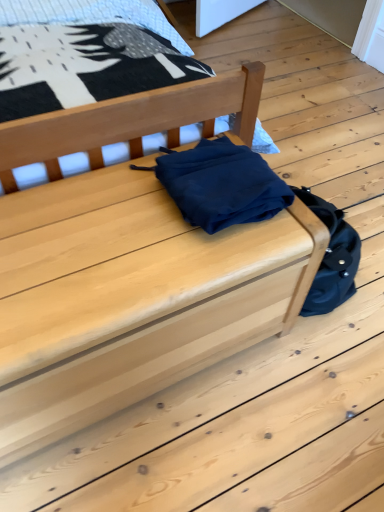
How much space does matte wood chest at center, arranged as the 1th furniture when ordered from the bottom, occupy vertically?

matte wood chest at center, arranged as the 1th furniture when ordered from the bottom, is 19.01 inches tall.

Describe the element at coordinates (131, 268) in the screenshot. I see `matte wood chest at center, the 2th furniture from the top` at that location.

Identify the location of matte wood chest at center, the 2th furniture from the top. The width and height of the screenshot is (384, 512). (131, 268).

Measure the distance between point (137,123) and camera.

Point (137,123) and camera are 1.13 meters apart from each other.

What do you see at coordinates (138, 115) in the screenshot? I see `matte wood chest at center, which is counted as the first furniture, starting from the top` at bounding box center [138, 115].

Identify the location of matte wood chest at center, which is counted as the first furniture, starting from the top. The height and width of the screenshot is (512, 384). (138, 115).

Where is `matte wood chest at center, arranged as the 1th furniture when ordered from the bottom`? Image resolution: width=384 pixels, height=512 pixels. matte wood chest at center, arranged as the 1th furniture when ordered from the bottom is located at coordinates (131, 268).

Is matte wood chest at center, arranged as the 1th furniture when ordered from the bottom, to the right of matte wood chest at center, which is counted as the first furniture, starting from the top, from the viewer's perspective?

Correct, you'll find matte wood chest at center, arranged as the 1th furniture when ordered from the bottom, to the right of matte wood chest at center, which is counted as the first furniture, starting from the top.

Considering the relative positions of matte wood chest at center, arranged as the 1th furniture when ordered from the bottom, and matte wood chest at center, which is counted as the first furniture, starting from the top, in the image provided, is matte wood chest at center, arranged as the 1th furniture when ordered from the bottom, behind matte wood chest at center, which is counted as the first furniture, starting from the top,?

No, it is in front of matte wood chest at center, which is counted as the first furniture, starting from the top.

Does point (9, 435) come closer to viewer compared to point (201, 84)?

Yes.

From the image's perspective, is matte wood chest at center, the 2th furniture from the top, above or below matte wood chest at center, which is counted as the first furniture, starting from the top?

Based on their image positions, matte wood chest at center, the 2th furniture from the top, is located beneath matte wood chest at center, which is counted as the first furniture, starting from the top.

From a real-world perspective, is matte wood chest at center, the 2th furniture from the top, positioned over matte wood chest at center, placed as the second furniture when sorted from bottom to top, based on gravity?

No.

Considering the relative sizes of matte wood chest at center, the 2th furniture from the top, and matte wood chest at center, which is counted as the first furniture, starting from the top, in the image provided, is matte wood chest at center, the 2th furniture from the top, thinner than matte wood chest at center, which is counted as the first furniture, starting from the top,?

Indeed, matte wood chest at center, the 2th furniture from the top, has a lesser width compared to matte wood chest at center, which is counted as the first furniture, starting from the top.

Does matte wood chest at center, the 2th furniture from the top, have a lesser height compared to matte wood chest at center, placed as the second furniture when sorted from bottom to top?

Indeed, matte wood chest at center, the 2th furniture from the top, has a lesser height compared to matte wood chest at center, placed as the second furniture when sorted from bottom to top.

Considering the relative sizes of matte wood chest at center, the 2th furniture from the top, and matte wood chest at center, which is counted as the first furniture, starting from the top, in the image provided, is matte wood chest at center, the 2th furniture from the top, smaller than matte wood chest at center, which is counted as the first furniture, starting from the top,?

Correct, matte wood chest at center, the 2th furniture from the top, occupies less space than matte wood chest at center, which is counted as the first furniture, starting from the top.

Can we say matte wood chest at center, arranged as the 1th furniture when ordered from the bottom, lies outside matte wood chest at center, which is counted as the first furniture, starting from the top?

Absolutely, matte wood chest at center, arranged as the 1th furniture when ordered from the bottom, is external to matte wood chest at center, which is counted as the first furniture, starting from the top.

Are matte wood chest at center, the 2th furniture from the top, and matte wood chest at center, which is counted as the first furniture, starting from the top, beside each other?

matte wood chest at center, the 2th furniture from the top, and matte wood chest at center, which is counted as the first furniture, starting from the top, are clearly separated.

Is matte wood chest at center, arranged as the 1th furniture when ordered from the bottom, turned away from matte wood chest at center, which is counted as the first furniture, starting from the top?

Correct, matte wood chest at center, arranged as the 1th furniture when ordered from the bottom, is looking away from matte wood chest at center, which is counted as the first furniture, starting from the top.

In the image, there is a matte wood chest at center, placed as the second furniture when sorted from bottom to top. Where is `furniture below it (from a real-world perspective)`? The height and width of the screenshot is (512, 384). furniture below it (from a real-world perspective) is located at coordinates (131, 268).

Does matte wood chest at center, which is counted as the first furniture, starting from the top, appear on the right side of matte wood chest at center, arranged as the 1th furniture when ordered from the bottom?

No, matte wood chest at center, which is counted as the first furniture, starting from the top, is not to the right of matte wood chest at center, arranged as the 1th furniture when ordered from the bottom.

Does matte wood chest at center, placed as the second furniture when sorted from bottom to top, lie behind matte wood chest at center, arranged as the 1th furniture when ordered from the bottom?

Yes, the depth of matte wood chest at center, placed as the second furniture when sorted from bottom to top, is greater than that of matte wood chest at center, arranged as the 1th furniture when ordered from the bottom.

Considering the points (229, 78) and (5, 346), which point is behind, point (229, 78) or point (5, 346)?

Positioned behind is point (229, 78).

In the scene shown: From the image's perspective, who appears lower, matte wood chest at center, which is counted as the first furniture, starting from the top, or matte wood chest at center, the 2th furniture from the top?

matte wood chest at center, the 2th furniture from the top, appears lower in the image.

From a real-world perspective, is matte wood chest at center, which is counted as the first furniture, starting from the top, physically located above or below matte wood chest at center, the 2th furniture from the top?

From a real-world perspective, matte wood chest at center, which is counted as the first furniture, starting from the top, is physically above matte wood chest at center, the 2th furniture from the top.

Which of these two, matte wood chest at center, placed as the second furniture when sorted from bottom to top, or matte wood chest at center, arranged as the 1th furniture when ordered from the bottom, is thinner?

matte wood chest at center, arranged as the 1th furniture when ordered from the bottom.

Considering the sizes of objects matte wood chest at center, placed as the second furniture when sorted from bottom to top, and matte wood chest at center, arranged as the 1th furniture when ordered from the bottom, in the image provided, who is shorter, matte wood chest at center, placed as the second furniture when sorted from bottom to top, or matte wood chest at center, arranged as the 1th furniture when ordered from the bottom,?

matte wood chest at center, arranged as the 1th furniture when ordered from the bottom.

Who is smaller, matte wood chest at center, placed as the second furniture when sorted from bottom to top, or matte wood chest at center, the 2th furniture from the top?

Smaller between the two is matte wood chest at center, the 2th furniture from the top.

Is matte wood chest at center, which is counted as the first furniture, starting from the top, inside or outside of matte wood chest at center, arranged as the 1th furniture when ordered from the bottom?

matte wood chest at center, which is counted as the first furniture, starting from the top, is not enclosed by matte wood chest at center, arranged as the 1th furniture when ordered from the bottom.

In the scene shown: Does matte wood chest at center, placed as the second furniture when sorted from bottom to top, touch matte wood chest at center, arranged as the 1th furniture when ordered from the bottom?

No, matte wood chest at center, placed as the second furniture when sorted from bottom to top, is not next to matte wood chest at center, arranged as the 1th furniture when ordered from the bottom.

Is matte wood chest at center, arranged as the 1th furniture when ordered from the bottom, at the back of matte wood chest at center, placed as the second furniture when sorted from bottom to top?

matte wood chest at center, placed as the second furniture when sorted from bottom to top, does not have its back to matte wood chest at center, arranged as the 1th furniture when ordered from the bottom.

What's the angular difference between matte wood chest at center, which is counted as the first furniture, starting from the top, and matte wood chest at center, arranged as the 1th furniture when ordered from the bottom,'s facing directions?

0.337 degrees separate the facing orientations of matte wood chest at center, which is counted as the first furniture, starting from the top, and matte wood chest at center, arranged as the 1th furniture when ordered from the bottom.

You are a GUI agent. You are given a task and a screenshot of the screen. Output one action in this format:
    pyautogui.click(x=<x>, y=<y>)
    Task: Click on the furniture below the matte wood chest at center, placed as the second furniture when sorted from bottom to top (from a real-world perspective)
    
    Given the screenshot: What is the action you would take?
    pyautogui.click(x=131, y=268)

I want to click on furniture directly beneath the matte wood chest at center, placed as the second furniture when sorted from bottom to top (from a real-world perspective), so click(x=131, y=268).

This screenshot has width=384, height=512. In order to click on furniture that appears in front of the matte wood chest at center, which is counted as the first furniture, starting from the top in this screenshot , I will do `click(131, 268)`.